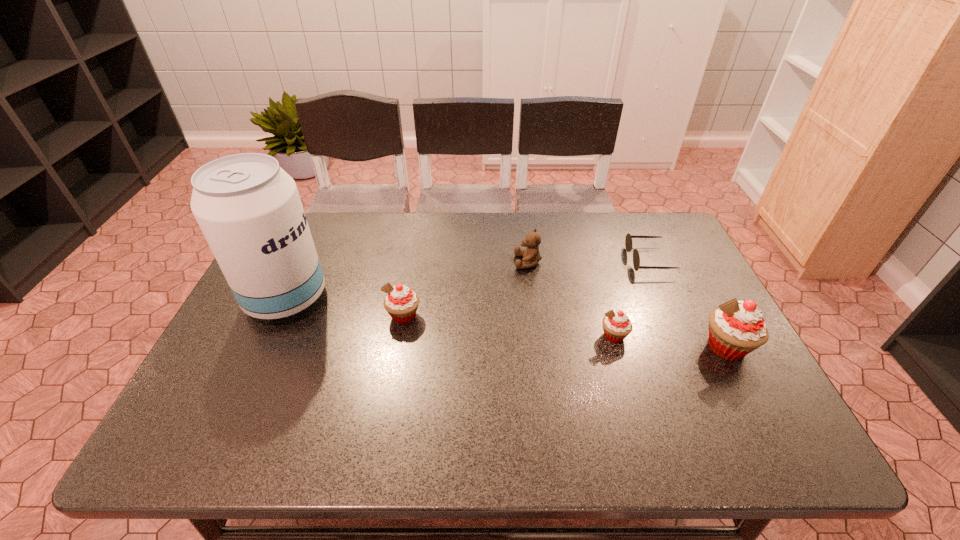
At what (x,y) coordinates should I click in order to perform the action: click on sunglasses located at the far edge. Please return your answer as a coordinate pair (x, y). Looking at the image, I should click on (628, 241).

Identify the location of teddy bear located at the far edge. (531, 256).

The width and height of the screenshot is (960, 540). I want to click on object at the left edge, so click(248, 208).

Identify the location of cupcake that is positioned at the right edge. (736, 328).

The height and width of the screenshot is (540, 960). I want to click on sunglasses present at the right edge, so click(x=628, y=241).

The height and width of the screenshot is (540, 960). I want to click on object situated at the far right corner, so click(628, 241).

This screenshot has width=960, height=540. In order to click on free space at the far edge in this screenshot , I will do `click(563, 218)`.

Find the location of a particular element. vacant space at the near edge of the desktop is located at coordinates (658, 405).

I want to click on free location at the left edge, so click(223, 356).

Image resolution: width=960 pixels, height=540 pixels. In the image, there is a desktop. In order to click on free space at the right edge in this screenshot , I will do `click(709, 350)`.